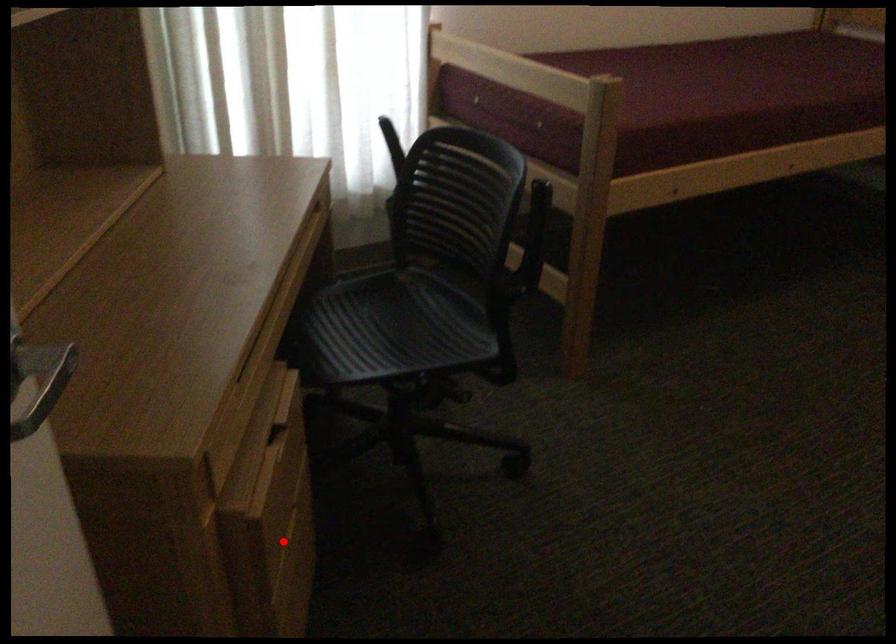
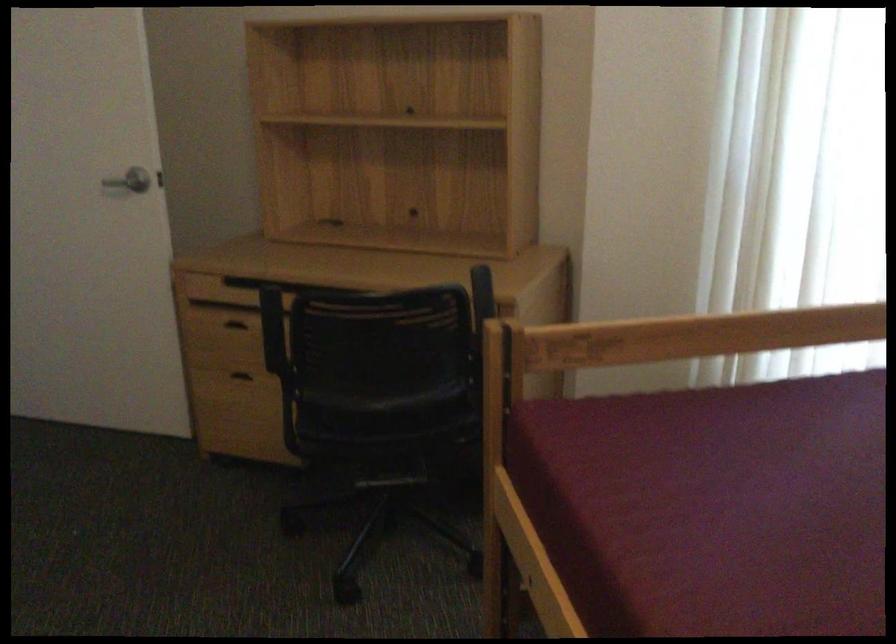
The point at the highlighted location is marked in the first image. Where is the corresponding point in the second image?

(246, 374)